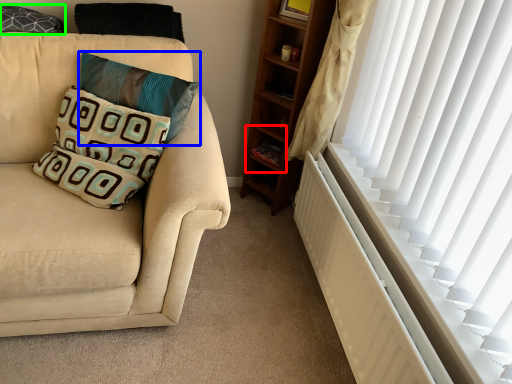
Question: Which object is the farthest from shelf (highlighted by a red box)? Choose among these: pillow (highlighted by a blue box) or pillow (highlighted by a green box).

Choices:
 (A) pillow
 (B) pillow

Answer: (B)